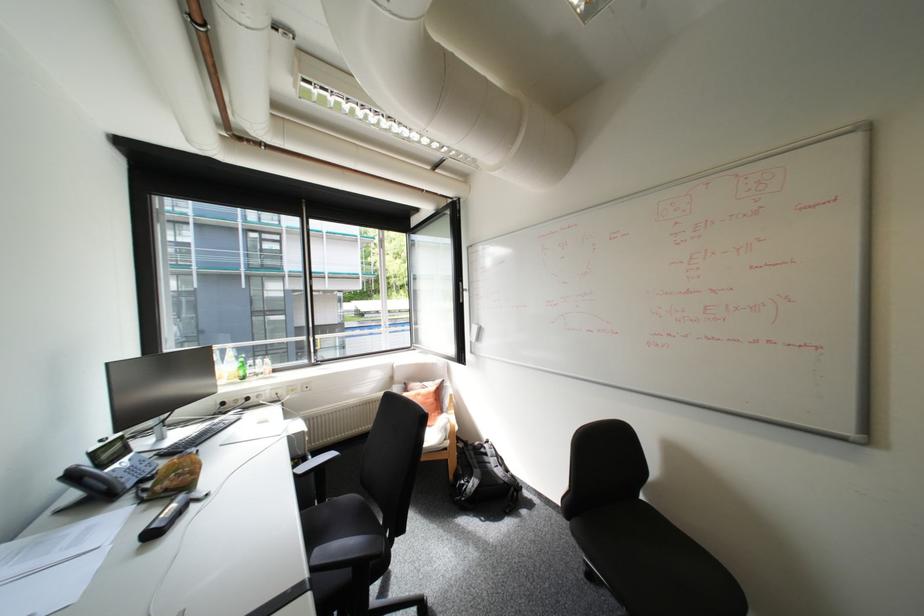
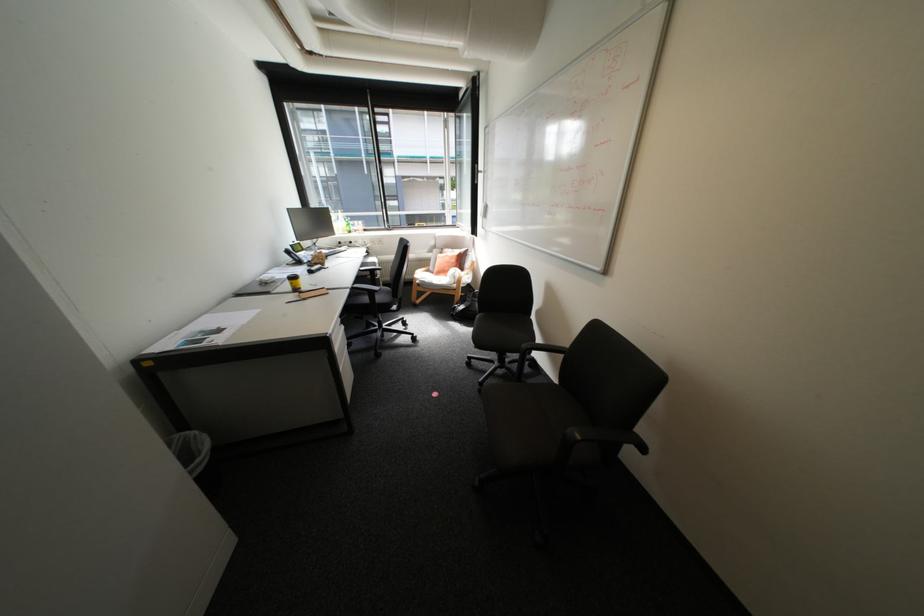
The point at (428, 384) is marked in the first image. Where is the corresponding point in the second image?

(459, 249)